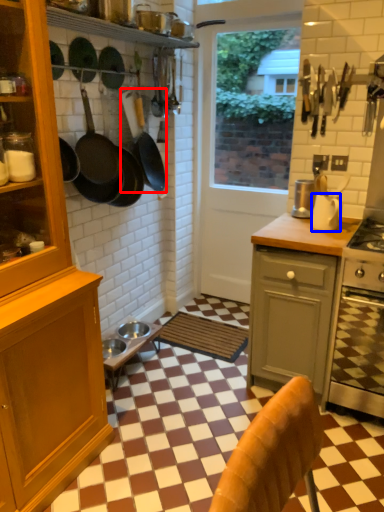
Question: Which of the following is the closest to the observer, frying pan (highlighted by a red box) or kitchen appliance (highlighted by a blue box)?

Choices:
 (A) frying pan
 (B) kitchen appliance

Answer: (B)